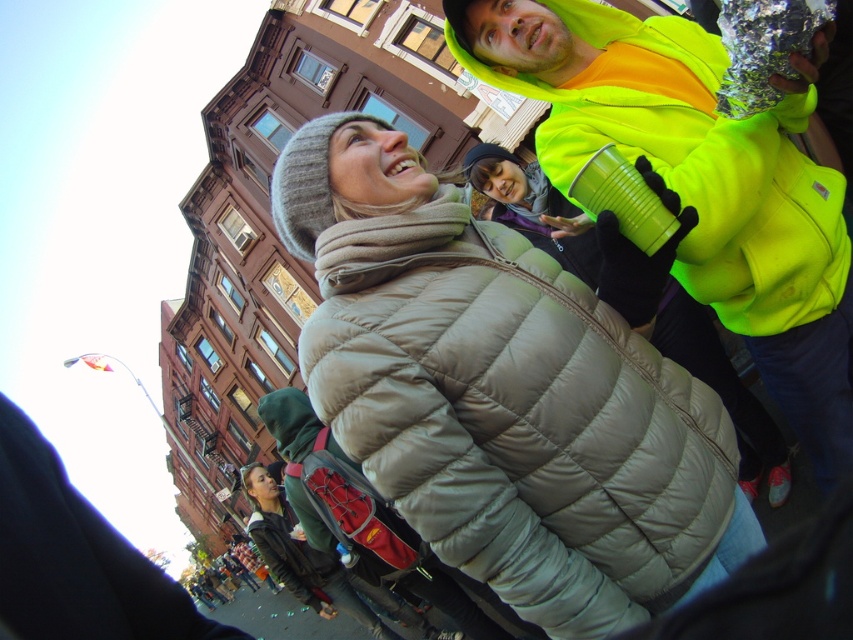
In the scene shown: Between matte gray puffer jacket at center and dark green quilted jacket at lower left, which one has more height?

dark green quilted jacket at lower left

Is point (442, 192) positioned before point (115, 586)?

No.

I want to click on matte gray puffer jacket at center, so click(515, 417).

The width and height of the screenshot is (853, 640). What are the coordinates of `matte gray puffer jacket at center` in the screenshot? It's located at (515, 417).

Is point (325, 410) more distant than point (808, 316)?

No, it is in front of (808, 316).

Describe the element at coordinates (515, 417) in the screenshot. The image size is (853, 640). I see `matte gray puffer jacket at center` at that location.

Locate an element on the screen. The height and width of the screenshot is (640, 853). matte gray puffer jacket at center is located at coordinates (515, 417).

Can you confirm if neon yellow fleece at upper right is wider than dark green quilted jacket at lower left?

Correct, the width of neon yellow fleece at upper right exceeds that of dark green quilted jacket at lower left.

Is neon yellow fleece at upper right above dark green quilted jacket at lower left?

Yes, neon yellow fleece at upper right is above dark green quilted jacket at lower left.

You are a GUI agent. You are given a task and a screenshot of the screen. Output one action in this format:
    pyautogui.click(x=<x>, y=<y>)
    Task: Click on the neon yellow fleece at upper right
    Image resolution: width=853 pixels, height=640 pixels.
    Given the screenshot: What is the action you would take?
    pyautogui.click(x=711, y=192)